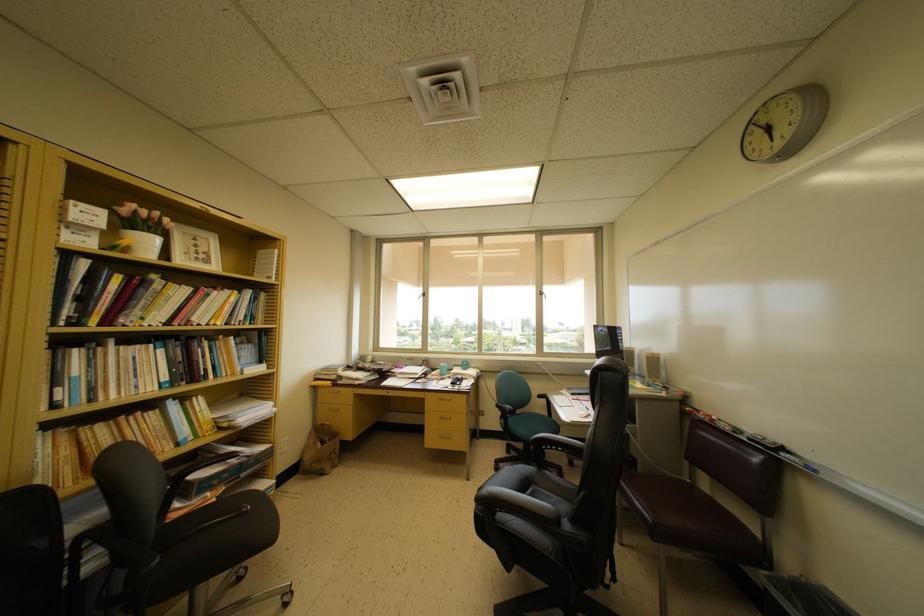
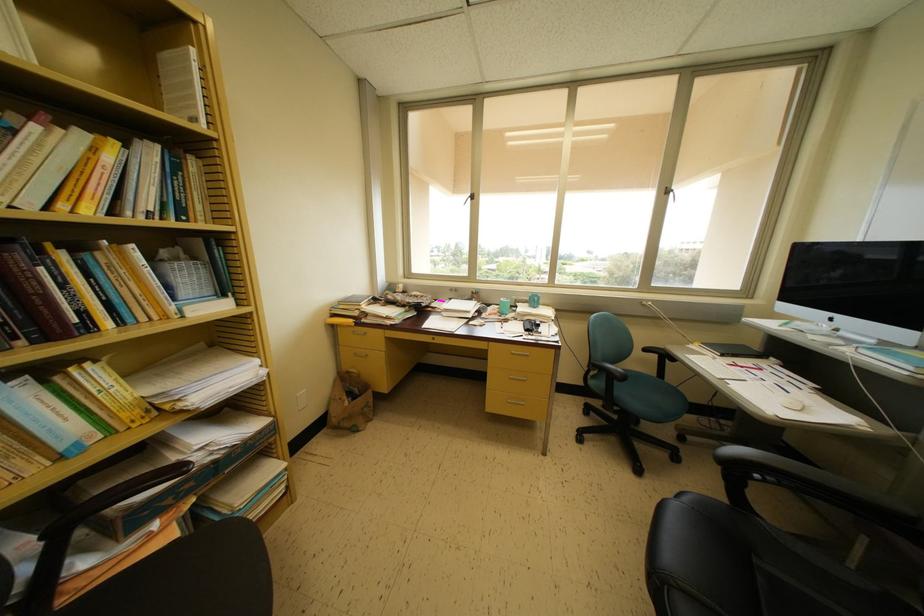
The point at [409,371] is marked in the first image. Where is the corresponding point in the second image?

(455, 304)